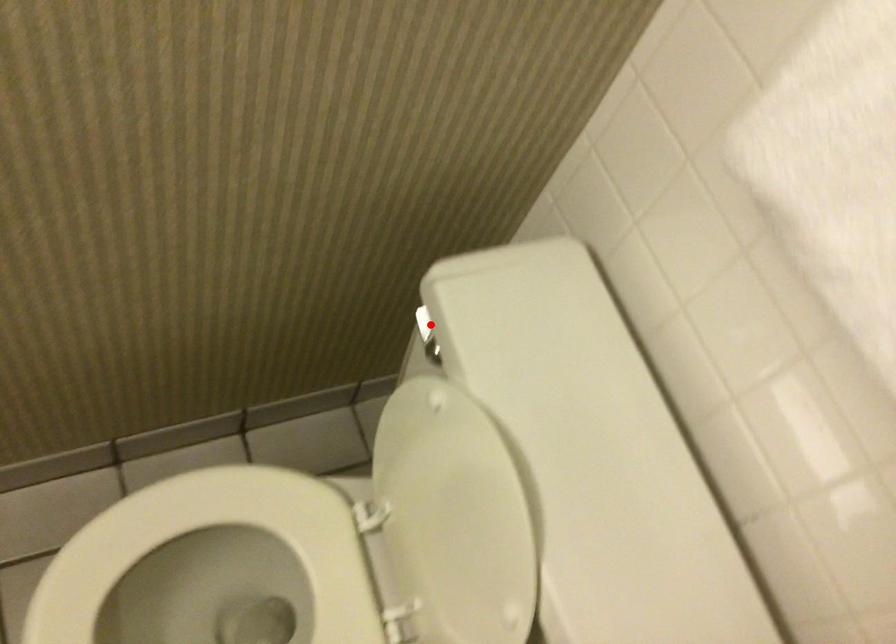
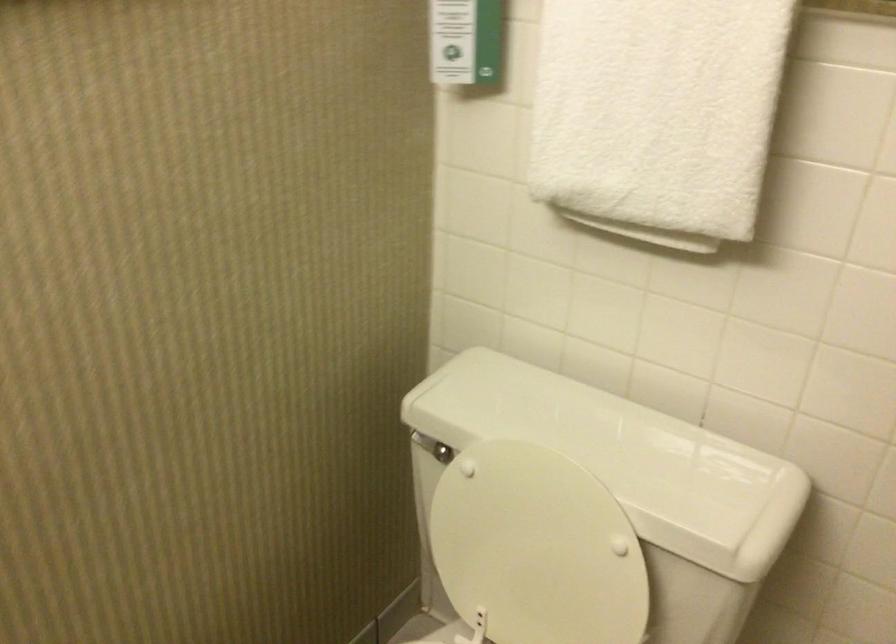
Question: I am providing you with two images of the same scene from different viewpoints. Given a red point in image1, look at the same physical point in image2. Is it:

Choices:
 (A) Closer to the viewpoint
 (B) Farther from the viewpoint

Answer: (B)